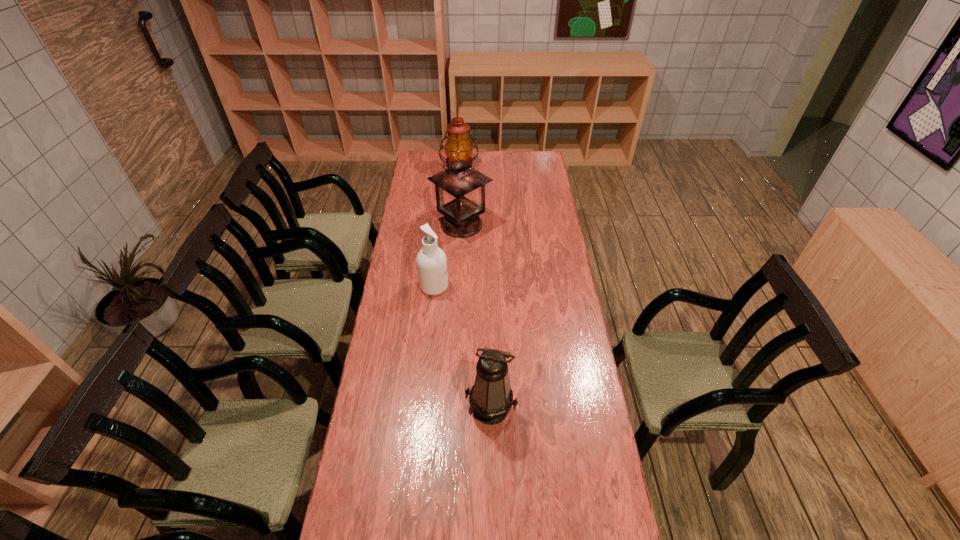
Where is `the third nearest object`? The width and height of the screenshot is (960, 540). the third nearest object is located at coordinates (460, 190).

You are a GUI agent. You are given a task and a screenshot of the screen. Output one action in this format:
    pyautogui.click(x=<x>, y=<y>)
    Task: Click on the farthest oil lamp
    This screenshot has width=960, height=540.
    Given the screenshot: What is the action you would take?
    pyautogui.click(x=458, y=140)

This screenshot has height=540, width=960. I want to click on cleansing agent, so click(x=431, y=261).

Locate an element on the screen. the nearest object is located at coordinates (491, 397).

This screenshot has width=960, height=540. In order to click on the nearest oil lamp in this screenshot , I will do `click(491, 397)`.

Locate an element on the screen. The image size is (960, 540). vacant region located on the back of the second farthest oil lamp is located at coordinates (463, 201).

Locate an element on the screen. vacant space located on the back of the farthest object is located at coordinates (461, 153).

Locate an element on the screen. Image resolution: width=960 pixels, height=540 pixels. vacant space situated on the front label of the cleansing agent is located at coordinates (484, 286).

Identify the location of vacant space located 0.140m on the right of the shortest oil lamp. The width and height of the screenshot is (960, 540). (558, 407).

Identify the location of object at the far edge. The image size is (960, 540). (458, 140).